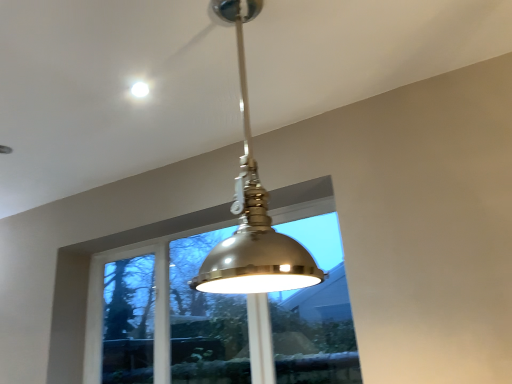
Question: Can you confirm if metallic dome at upper center is thinner than clear glass window at center?

Choices:
 (A) yes
 (B) no

Answer: (A)

Question: From a real-world perspective, is metallic dome at upper center positioned over clear glass window at center based on gravity?

Choices:
 (A) yes
 (B) no

Answer: (A)

Question: From a real-world perspective, is metallic dome at upper center located beneath clear glass window at center?

Choices:
 (A) no
 (B) yes

Answer: (A)

Question: From the image's perspective, is metallic dome at upper center beneath clear glass window at center?

Choices:
 (A) yes
 (B) no

Answer: (B)

Question: Considering the relative sizes of metallic dome at upper center and clear glass window at center in the image provided, is metallic dome at upper center bigger than clear glass window at center?

Choices:
 (A) no
 (B) yes

Answer: (A)

Question: Considering the positions of metallic dome at upper center and metallic dome at center in the image, is metallic dome at upper center taller or shorter than metallic dome at center?

Choices:
 (A) short
 (B) tall

Answer: (A)

Question: In the image, is metallic dome at upper center on the left side or the right side of metallic dome at center?

Choices:
 (A) left
 (B) right

Answer: (A)

Question: Is metallic dome at upper center in front of or behind metallic dome at center in the image?

Choices:
 (A) behind
 (B) front

Answer: (A)

Question: From the image's perspective, is metallic dome at upper center above or below metallic dome at center?

Choices:
 (A) below
 (B) above

Answer: (B)

Question: In terms of size, does metallic dome at center appear bigger or smaller than clear glass window at center?

Choices:
 (A) big
 (B) small

Answer: (B)

Question: Is metallic dome at center taller or shorter than clear glass window at center?

Choices:
 (A) tall
 (B) short

Answer: (B)

Question: From a real-world perspective, is metallic dome at center above or below clear glass window at center?

Choices:
 (A) below
 (B) above

Answer: (B)

Question: In terms of width, does metallic dome at center look wider or thinner when compared to clear glass window at center?

Choices:
 (A) thin
 (B) wide

Answer: (B)

Question: From the image's perspective, relative to clear glass window at center, is metallic dome at upper center above or below?

Choices:
 (A) below
 (B) above

Answer: (B)

Question: Relative to clear glass window at center, is metallic dome at upper center in front or behind?

Choices:
 (A) front
 (B) behind

Answer: (A)